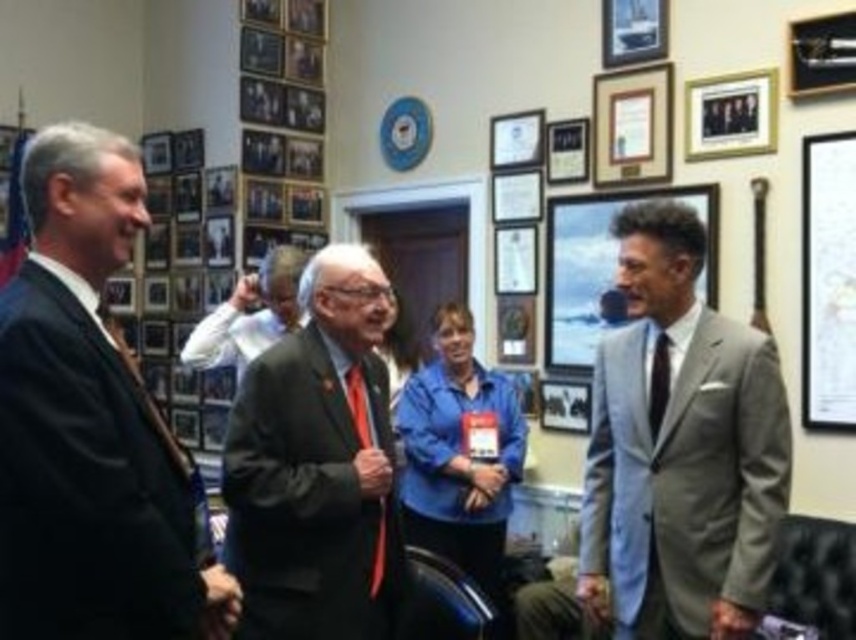
Question: Can you confirm if white paper at right is positioned to the left of matte gray frame at right?

Choices:
 (A) yes
 (B) no

Answer: (B)

Question: Observing the image, what is the correct spatial positioning of matte gray frame at right in reference to wooden picture frame at upper right?

Choices:
 (A) left
 (B) right

Answer: (A)

Question: Which point is closer to the camera taking this photo?

Choices:
 (A) (750, 582)
 (B) (706, 272)
 (C) (617, 104)

Answer: (A)

Question: Which of the following is the closest to the observer?

Choices:
 (A) (646, 17)
 (B) (539, 125)

Answer: (A)

Question: Estimate the real-world distances between objects in this image. Which object is closer to the dark gray suit at center?

Choices:
 (A) red satin tie at center
 (B) gray suit at right

Answer: (A)

Question: Does matte silver picture frame at upper center appear over red satin tie at center?

Choices:
 (A) yes
 (B) no

Answer: (A)